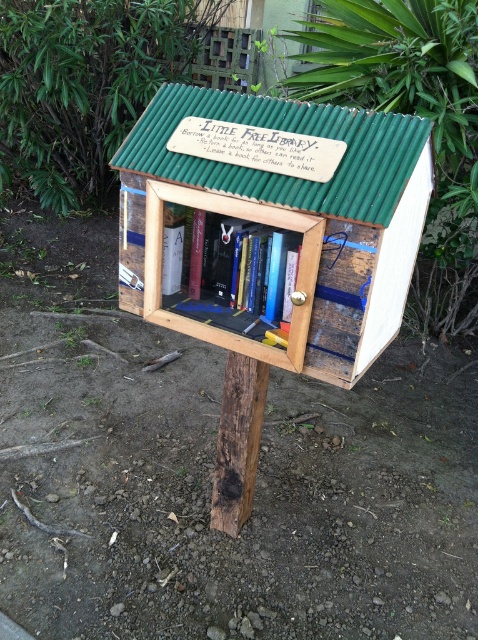
Question: Which point is closer to the camera?

Choices:
 (A) wooden bookshelf at center
 (B) hardcover book at center

Answer: (A)

Question: Observing the image, what is the correct spatial positioning of wooden bookshelf at center in reference to hardcover book at center?

Choices:
 (A) below
 (B) above

Answer: (B)

Question: Is wooden bookshelf at center wider than hardcover book at center?

Choices:
 (A) no
 (B) yes

Answer: (B)

Question: Can you confirm if wooden bookshelf at center is wider than hardcover book at center?

Choices:
 (A) no
 (B) yes

Answer: (B)

Question: Among these points, which one is nearest to the camera?

Choices:
 (A) (290, 234)
 (B) (264, 356)

Answer: (B)